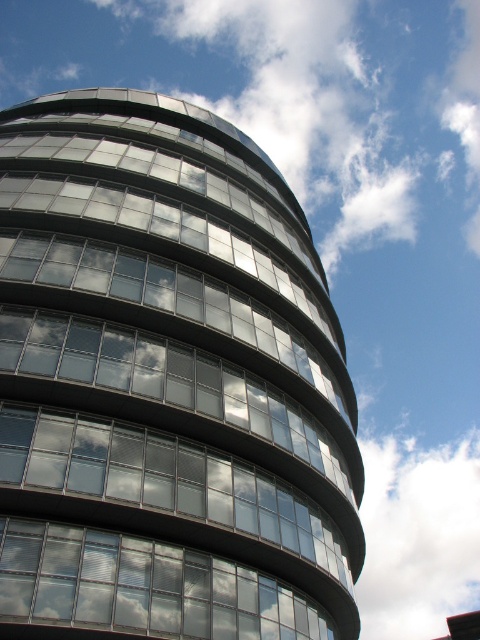
Question: Which point appears farthest from the camera in this image?

Choices:
 (A) (103, 573)
 (B) (95, 449)

Answer: (B)

Question: Which object appears closest to the camera in this image?

Choices:
 (A) transparent glass building at center
 (B) transparent glass windows at center
 (C) white fluffy cloud at upper right

Answer: (A)

Question: Which point is closer to the camera?

Choices:
 (A) white fluffy cloud at upper right
 (B) transparent glass building at center
 (C) transparent glass windows at center

Answer: (B)

Question: Is transparent glass building at center closer to the viewer compared to white fluffy cloud at upper right?

Choices:
 (A) yes
 (B) no

Answer: (A)

Question: Can you confirm if transparent glass windows at center is smaller than white fluffy cloud at upper right?

Choices:
 (A) no
 (B) yes

Answer: (B)

Question: Is transparent glass building at center in front of white fluffy cloud at upper right?

Choices:
 (A) no
 (B) yes

Answer: (B)